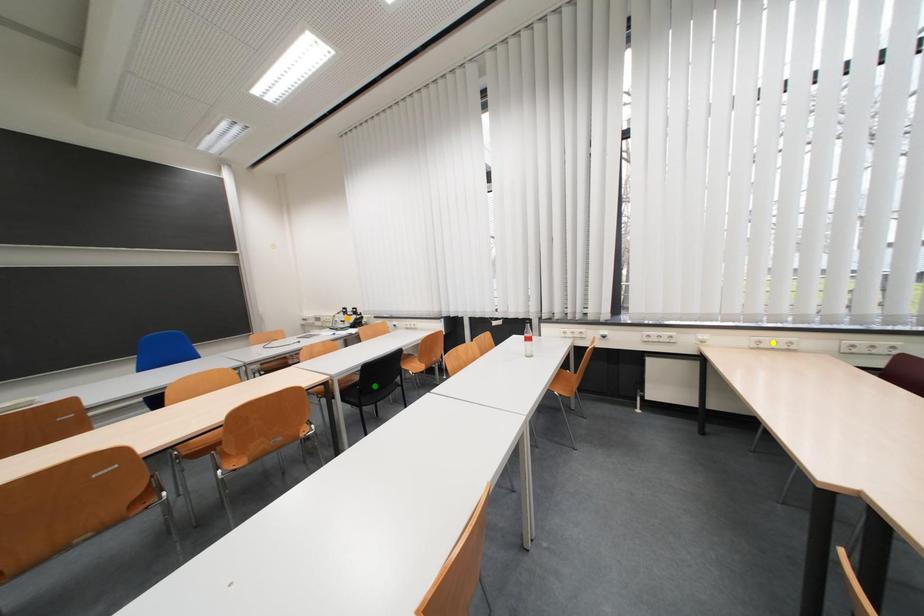
Order these from nearest to farthest:
green point
orange point
yellow point

yellow point < green point < orange point